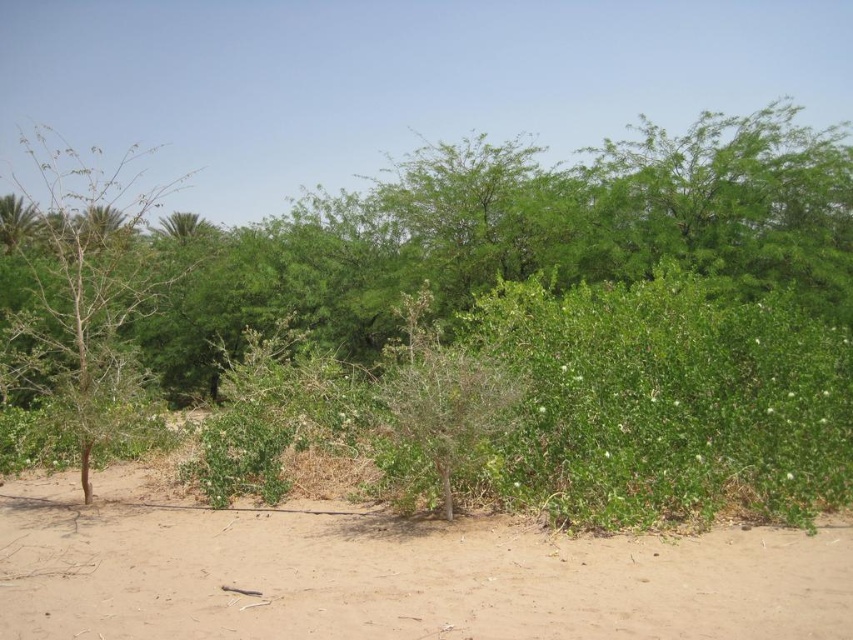
Does brown sandy dirt at center have a larger size compared to bare branches at left?

No, brown sandy dirt at center is not bigger than bare branches at left.

Between brown sandy dirt at center and bare branches at left, which one is positioned lower?

brown sandy dirt at center

Between point (311, 564) and point (137, 308), which one is positioned behind?

The point (137, 308) is behind.

Where is `brown sandy dirt at center`? brown sandy dirt at center is located at coordinates (392, 573).